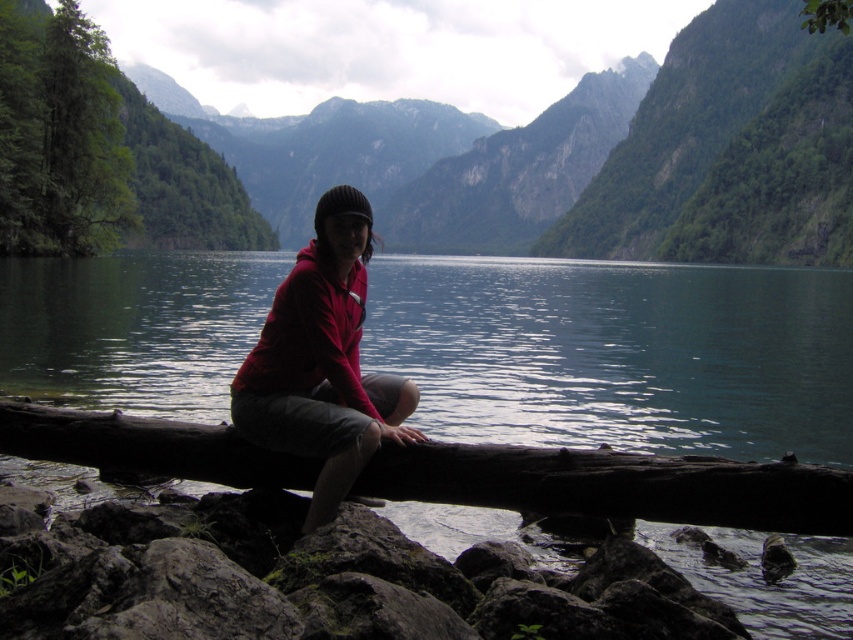
From the picture: You are a hiker who wants to place your matte red hoodie at center on the rough gray rock at lower left. Is the rock a suitable surface for placing the hoodie?

The rough gray rock at lower left is positioned under matte red hoodie at center, so yes, the rock is a suitable surface for placing the hoodie since it is located directly beneath it.

You are standing at the center of the image and want to place a small marker at the exact center of the image. Which object is closest to the center? The options are the rough gray rock at lower left and the person sitting on the log.

The rough gray rock at lower left is located at point (315,579), so the person sitting on the log is closer to the center of the image.